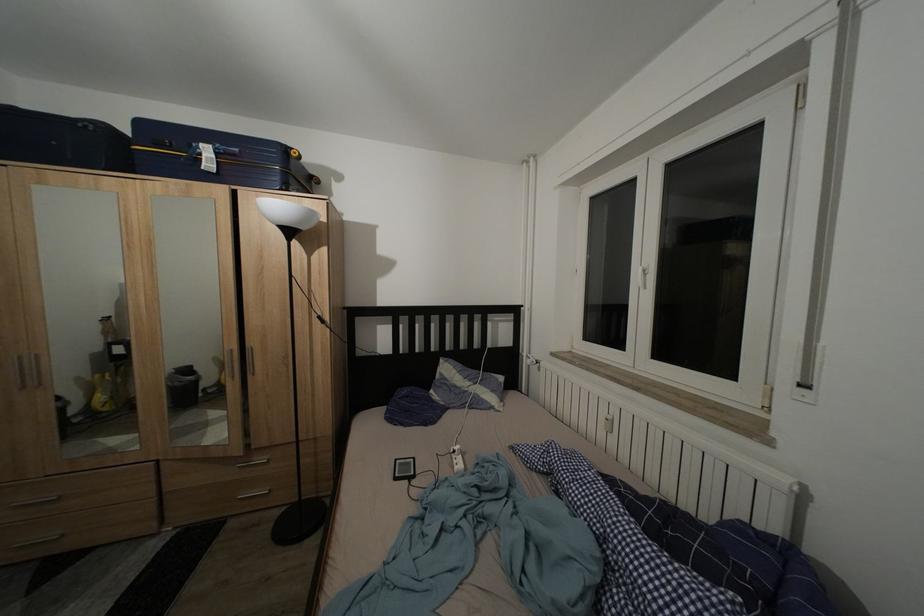
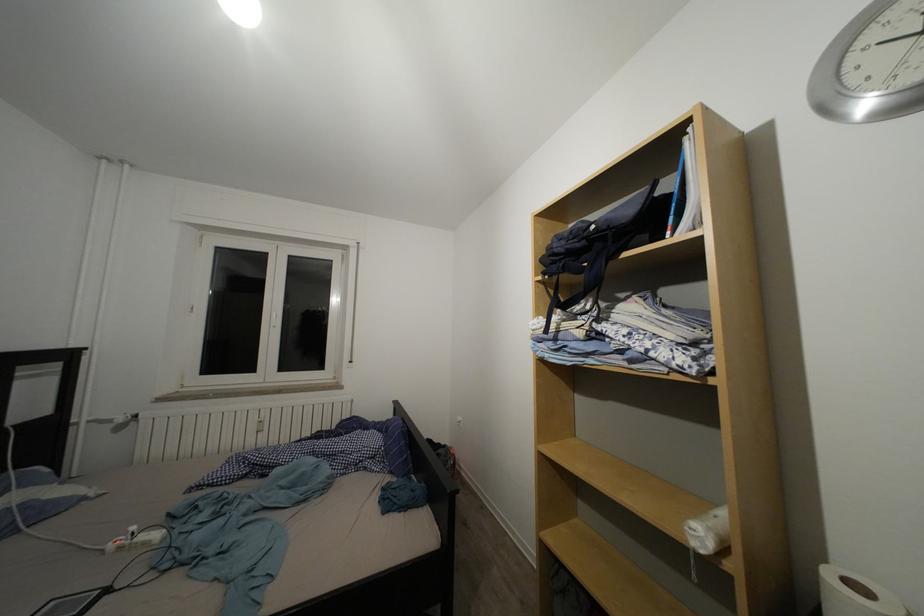
Locate, in the second image, the point that corresponds to point (419, 467) in the first image.

(61, 610)